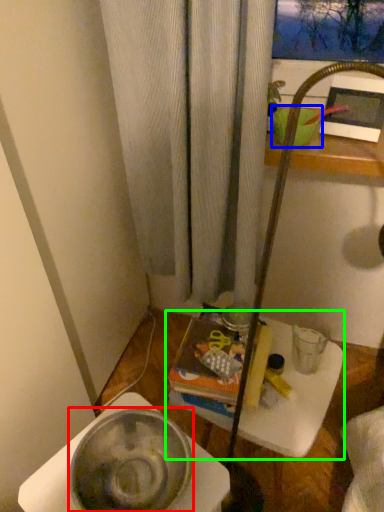
Question: Which object is positioned farthest from basin (highlighted by a red box)? Select from basin (highlighted by a blue box) and table (highlighted by a green box).

Choices:
 (A) basin
 (B) table

Answer: (A)